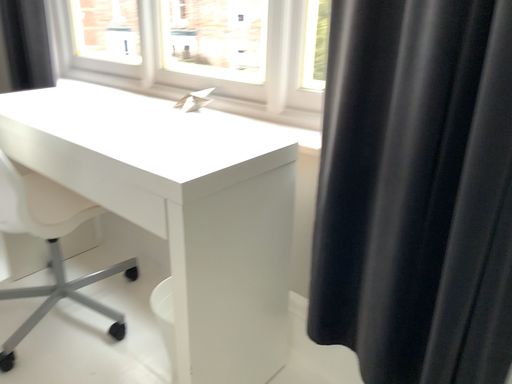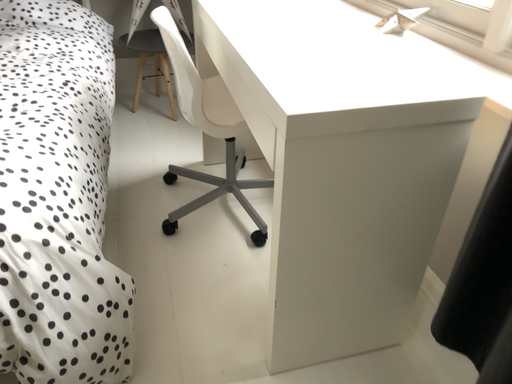
Question: Which way did the camera rotate in the video?

Choices:
 (A) rotated upward
 (B) rotated downward

Answer: (B)